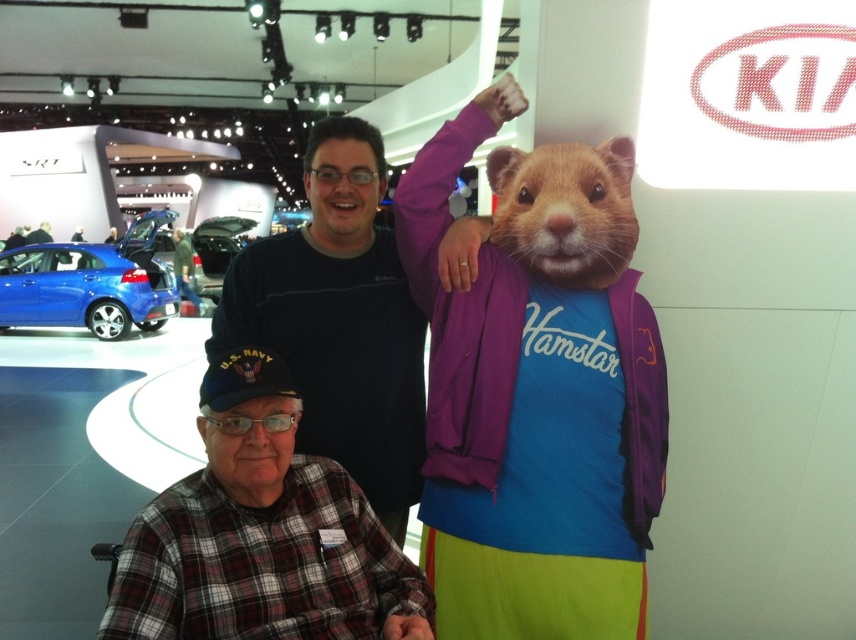
Question: Does golden fur hamster at center appear under shiny blue sedan at center?

Choices:
 (A) no
 (B) yes

Answer: (B)

Question: Which of the following is the closest to the observer?

Choices:
 (A) shiny blue sedan at center
 (B) shiny metallic car at center
 (C) dark blue cotton shirt at center

Answer: (C)

Question: Which object is farther from the camera taking this photo?

Choices:
 (A) shiny blue sedan at center
 (B) shiny metallic car at center
 (C) dark blue cotton shirt at center

Answer: (B)

Question: Does shiny blue sedan at center have a smaller size compared to shiny metallic car at center?

Choices:
 (A) yes
 (B) no

Answer: (A)

Question: Which of these objects is positioned closest to the plaid shirt at lower left?

Choices:
 (A) shiny metallic car at center
 (B) dark blue cotton shirt at center
 (C) shiny blue sedan at center

Answer: (B)

Question: In this image, where is plaid shirt at lower left located relative to shiny blue sedan at center?

Choices:
 (A) right
 (B) left

Answer: (A)